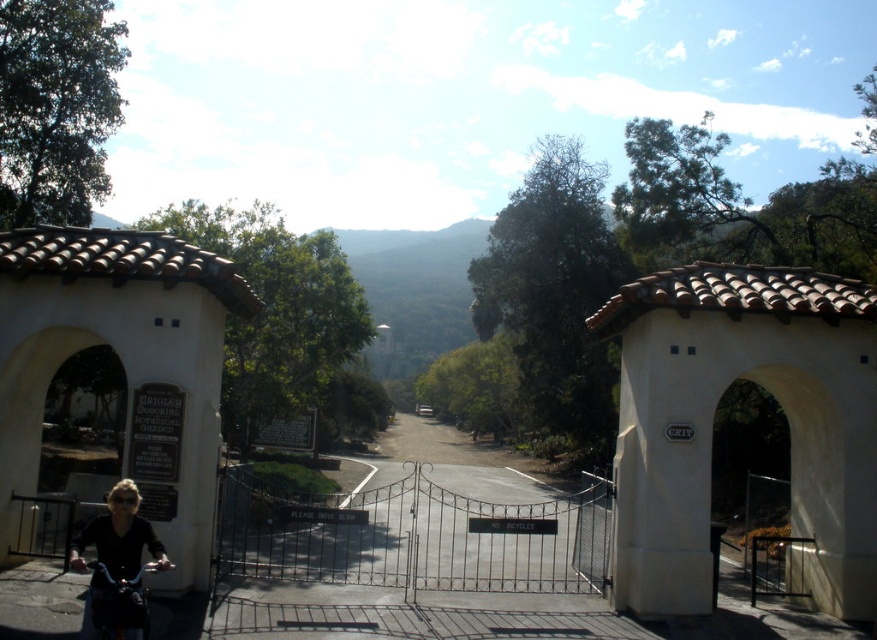
Question: Which object appears farthest from the camera in this image?

Choices:
 (A) black matte jacket at lower left
 (B) shiny black bicycle at lower left

Answer: (A)

Question: Which of the following is the closest to the observer?

Choices:
 (A) black matte jacket at lower left
 (B) shiny black bicycle at lower left

Answer: (B)

Question: Observing the image, what is the correct spatial positioning of black matte jacket at lower left in reference to shiny black bicycle at lower left?

Choices:
 (A) above
 (B) below

Answer: (A)

Question: Where is black matte jacket at lower left located in relation to shiny black bicycle at lower left in the image?

Choices:
 (A) above
 (B) below

Answer: (A)

Question: Does black matte jacket at lower left appear on the left side of shiny black bicycle at lower left?

Choices:
 (A) no
 (B) yes

Answer: (B)